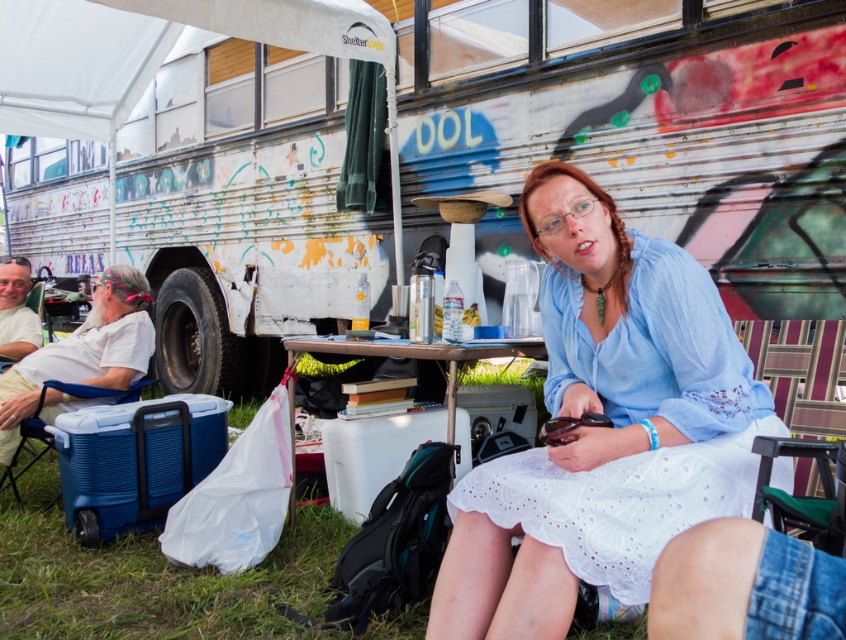
You are a photographer setting up a shoot in this outdoor scene. You need to position a 6ft tall model wearing a white lace dress at center so that they are visible from the front without obstruction. Given the white painted bus at center is in the background, will the model be visible behind it?

The white painted bus at center is shorter than the white lace dress at center, so the model wearing the white lace dress at center will be visible behind the white painted bus at center since the bus is shorter in height.

You are a photographer standing in front of the scene. You want to take a photo that includes both the white painted bus at center and the white lace dress at center. Which object should you focus on first to ensure both are in frame?

The white painted bus at center is located above the white lace dress at center, so you should focus on the white lace dress at center first to ensure both are in frame.

Consider the image. You are standing at the position of the woman in the scene. You want to reach the blue plastic cooler at lower left. Which direction should you move relative to the white painted bus at center?

The blue plastic cooler at lower left is behind the white painted bus at center, so you should move behind the white painted bus at center to reach it.